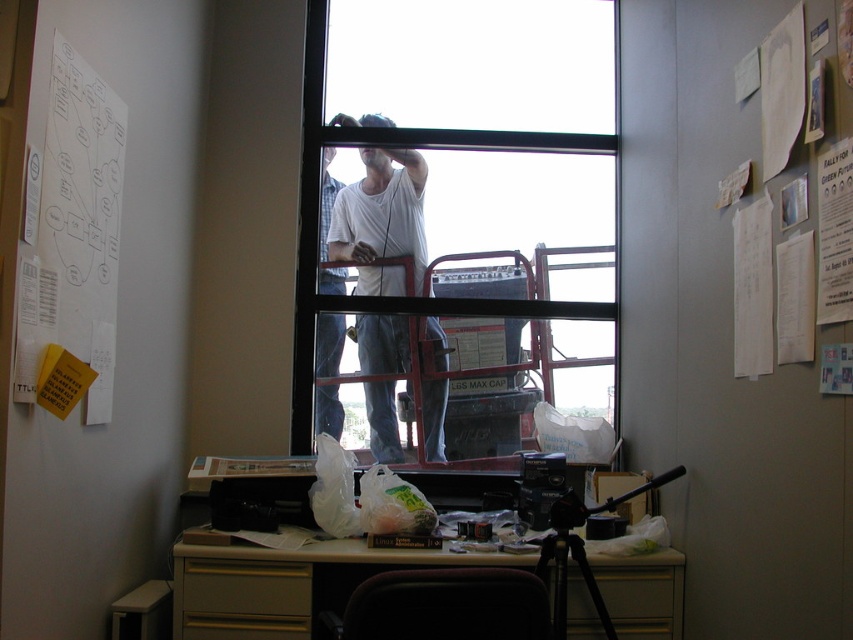
Question: Which object appears closest to the camera in this image?

Choices:
 (A) white cotton shirt at center
 (B) clear glass window at center
 (C) white plastic table at center

Answer: (C)

Question: Is white plastic table at center to the right of white paper at upper left from the viewer's perspective?

Choices:
 (A) no
 (B) yes

Answer: (B)

Question: Does white plastic table at center lie in front of white paper at upper left?

Choices:
 (A) no
 (B) yes

Answer: (A)

Question: Which point appears farthest from the camera in this image?

Choices:
 (A) (331, 428)
 (B) (86, 177)
 (C) (675, 620)

Answer: (A)

Question: Which object is farther from the camera taking this photo?

Choices:
 (A) white plastic table at center
 (B) white matte shirt at center
 (C) white cotton shirt at center

Answer: (B)

Question: Is white plastic table at center behind white cotton shirt at center?

Choices:
 (A) no
 (B) yes

Answer: (A)